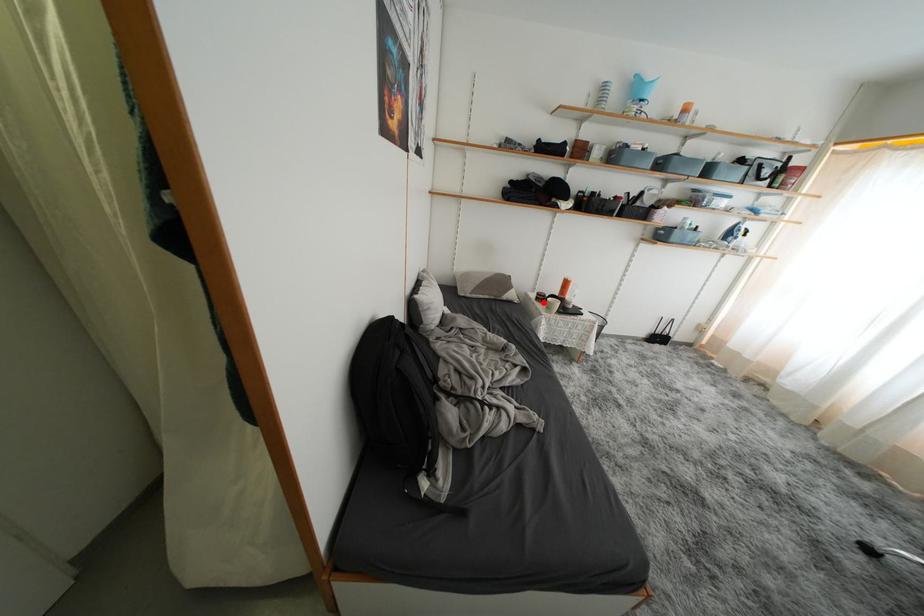
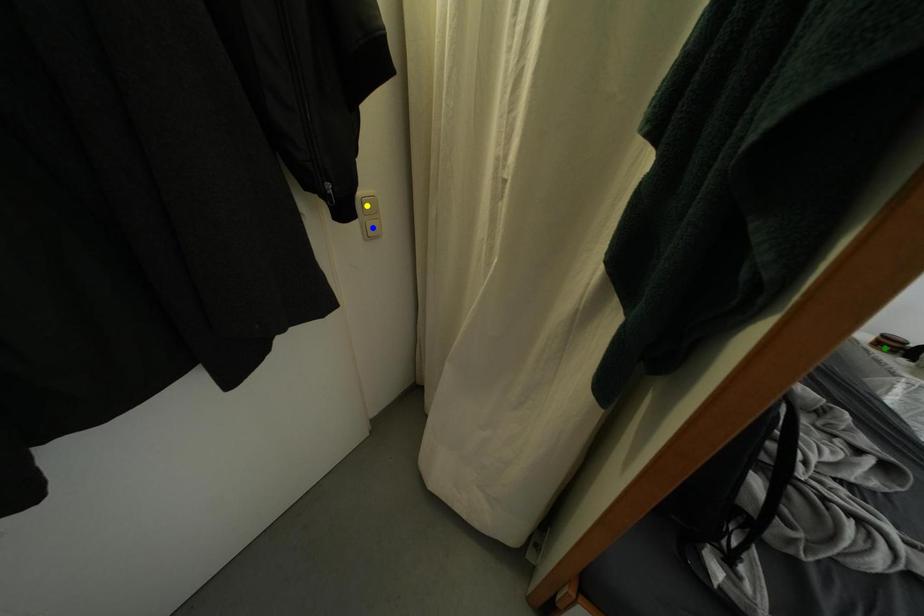
Question: I am providing you with two images of the same scene from different viewpoints. A red point is marked on the first image. You are given multiple points on the second image. In image 2, which mark is for the same physical point as the one in image 1?

Choices:
 (A) green point
 (B) yellow point
 (C) blue point

Answer: (A)